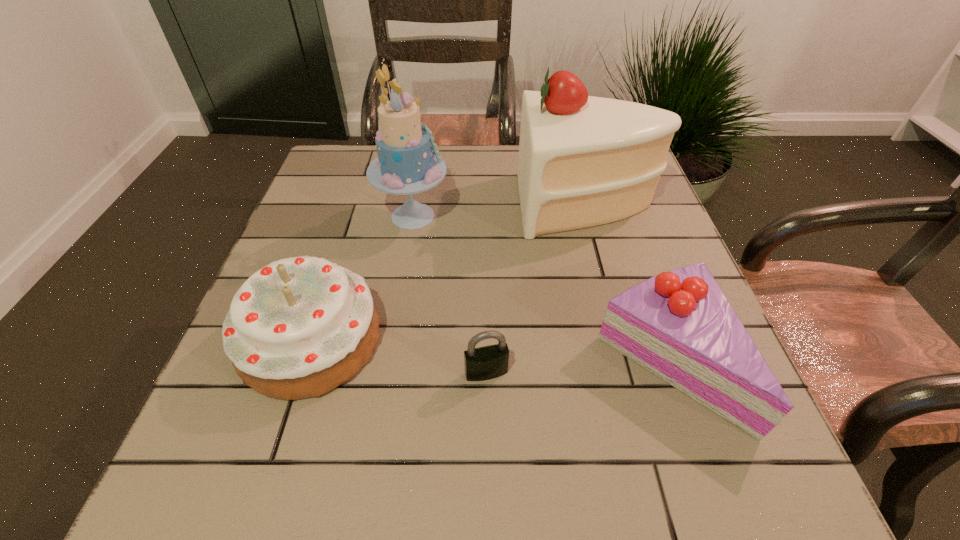
Locate an element on the screen. Image resolution: width=960 pixels, height=540 pixels. vacant space at the far edge is located at coordinates (455, 166).

Where is `vacant space at the near edge`? vacant space at the near edge is located at coordinates point(560,470).

Image resolution: width=960 pixels, height=540 pixels. I want to click on vacant space at the left edge of the desktop, so click(x=238, y=389).

The height and width of the screenshot is (540, 960). I want to click on free space at the right edge of the desktop, so click(614, 255).

In the image, there is a desktop. Identify the location of vacant space at the far left corner. This screenshot has width=960, height=540. (348, 160).

You are a GUI agent. You are given a task and a screenshot of the screen. Output one action in this format:
    pyautogui.click(x=<x>, y=<y>)
    Task: Click on the free space at the near left corner of the desktop
    
    Given the screenshot: What is the action you would take?
    pyautogui.click(x=230, y=483)

At what (x,y) coordinates should I click in order to perform the action: click on empty space between the second shortest object and the third object from left to right. Please return your answer as a coordinate pair (x, y). Image resolution: width=960 pixels, height=540 pixels. Looking at the image, I should click on (575, 367).

Locate an element on the screen. The height and width of the screenshot is (540, 960). free point between the second shortest object and the padlock is located at coordinates (575, 367).

This screenshot has width=960, height=540. What are the coordinates of `object that can be found as the closest to the shortest object` in the screenshot? It's located at (299, 327).

Where is `object that stands as the fourth closest to the second shortest object`? object that stands as the fourth closest to the second shortest object is located at coordinates (299, 327).